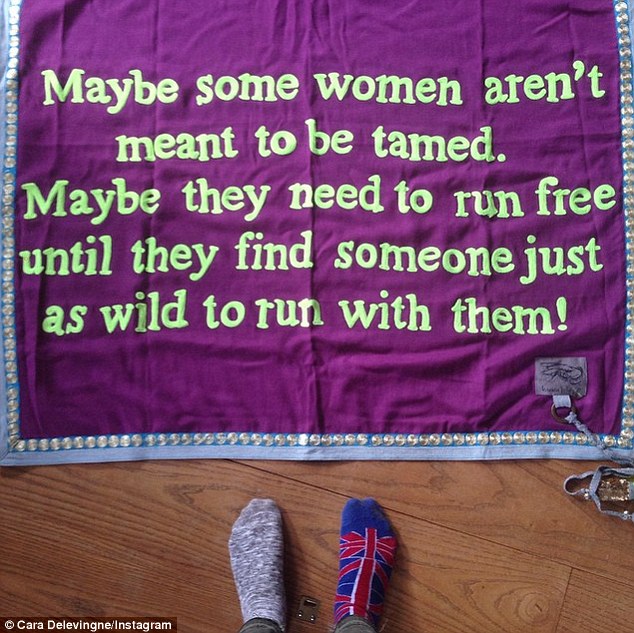
The height and width of the screenshot is (633, 634). What are the coordinates of `gray sock` in the screenshot? It's located at point(260,573).